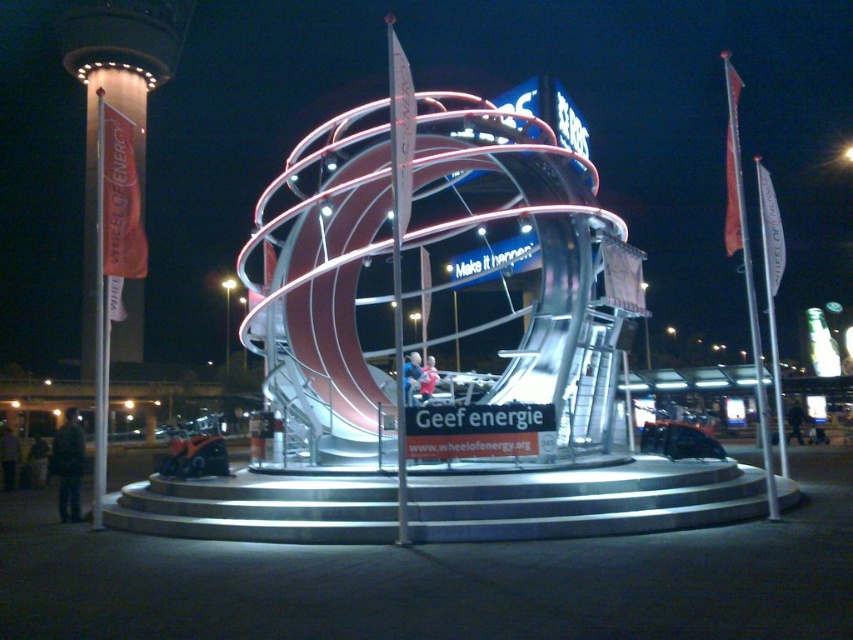
You are standing at the center of the event area and see the point marked at coordinates (746, 268). What object is located at this point?

The point at coordinates (746, 268) indicates a white flag at right.

You are standing at the center of the exhibition area and notice two points marked in the image. Which point, point (730,225) or point (96,273), is closer to you?

Point (730,225) is closer to the viewer than point (96,273).